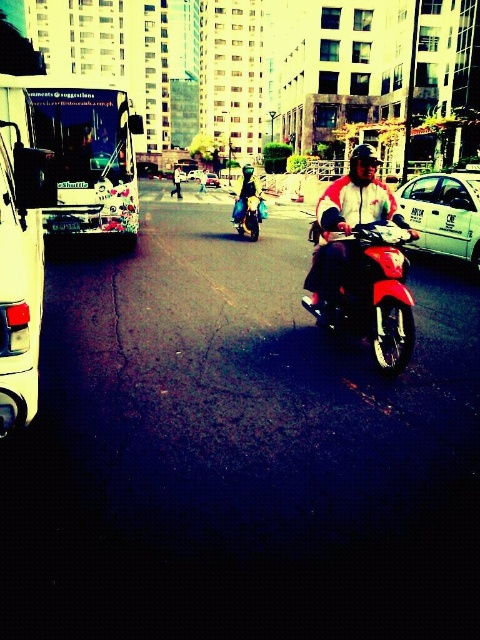
Is red matte motorcycle at center bigger than metallic silver car at center?

Actually, red matte motorcycle at center might be smaller than metallic silver car at center.

Is red matte motorcycle at center smaller than metallic silver car at center?

Correct, red matte motorcycle at center occupies less space than metallic silver car at center.

The image size is (480, 640). What do you see at coordinates (347, 228) in the screenshot?
I see `red matte motorcycle at center` at bounding box center [347, 228].

Where is `red matte motorcycle at center`? red matte motorcycle at center is located at coordinates (347, 228).

Is shiny blue motorcycle at center smaller than metallic silver car at center?

Yes.

The image size is (480, 640). What do you see at coordinates (249, 212) in the screenshot?
I see `shiny blue motorcycle at center` at bounding box center [249, 212].

The image size is (480, 640). I want to click on shiny blue motorcycle at center, so click(249, 212).

Can you confirm if red matte motorcycle at center is shorter than shiny blue motorcycle at center?

Incorrect, red matte motorcycle at center's height does not fall short of shiny blue motorcycle at center's.

Is point (363, 212) less distant than point (245, 227)?

That is True.

Is point (323, 225) farther from camera compared to point (256, 225)?

No, (323, 225) is in front of (256, 225).

You are a GUI agent. You are given a task and a screenshot of the screen. Output one action in this format:
    pyautogui.click(x=<x>, y=<y>)
    Task: Click on the red matte motorcycle at center
    
    Given the screenshot: What is the action you would take?
    pyautogui.click(x=347, y=228)